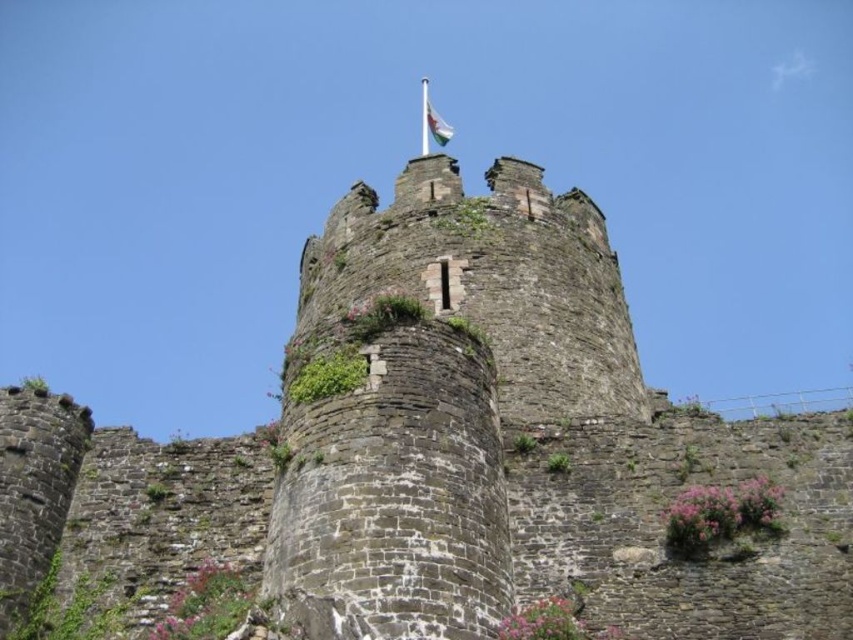
You are a medieval knight standing at the base of the castle tower. You notice the white fabric flag at top and the white fabric flagpole at top. How far apart are these two items?

The distance between the white fabric flag at top and the white fabric flagpole at top is 40.14 feet.

You are standing at the base of the castle tower and notice both the white fabric flag at top and the white fabric flagpole at top. From your vantage point, which object is positioned to the right of the other?

The white fabric flag at top is to the right of the white fabric flagpole at top.